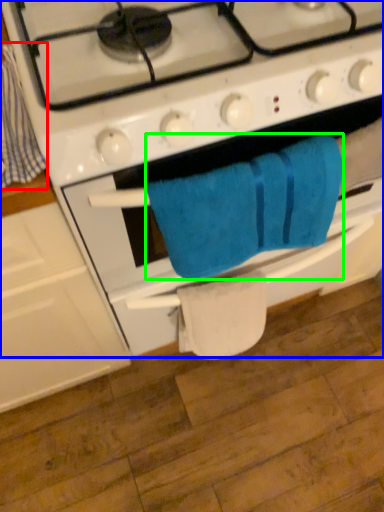
Question: Which object is the closest to the beach towel (highlighted by a red box)? Choose among these: gas stove (highlighted by a blue box) or towel/napkin (highlighted by a green box).

Choices:
 (A) gas stove
 (B) towel/napkin

Answer: (A)